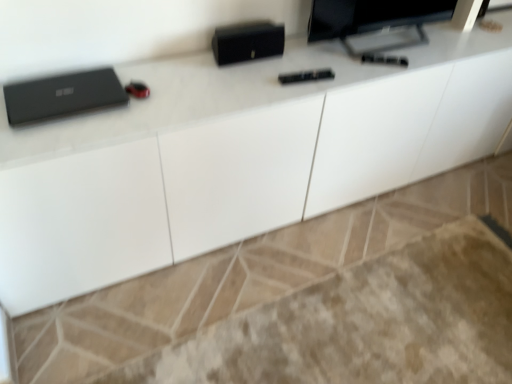
At what (x,y) coordinates should I click in order to perform the action: click on vacant area that is in front of matte black laptop at left. Please return your answer as a coordinate pair (x, y). The image size is (512, 384). Looking at the image, I should click on (52, 142).